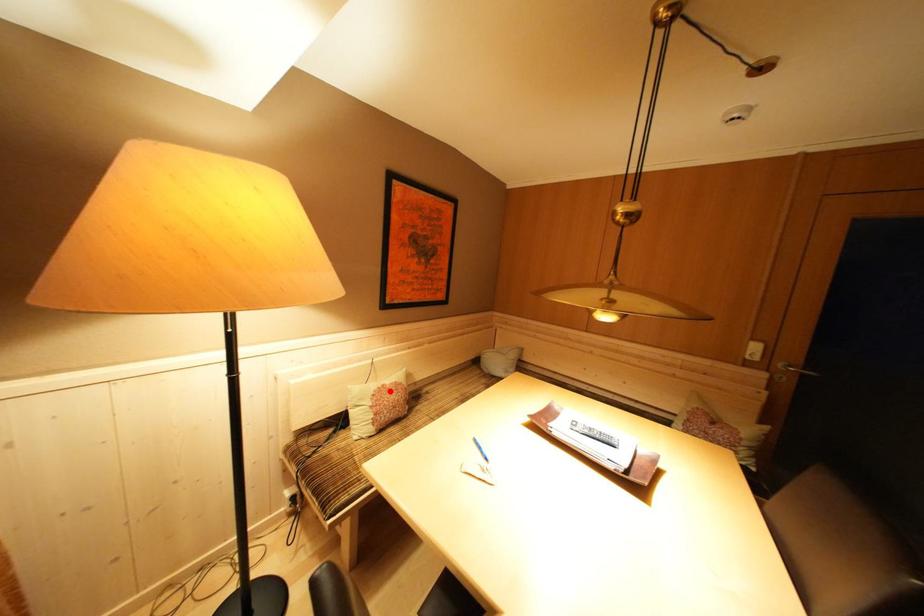
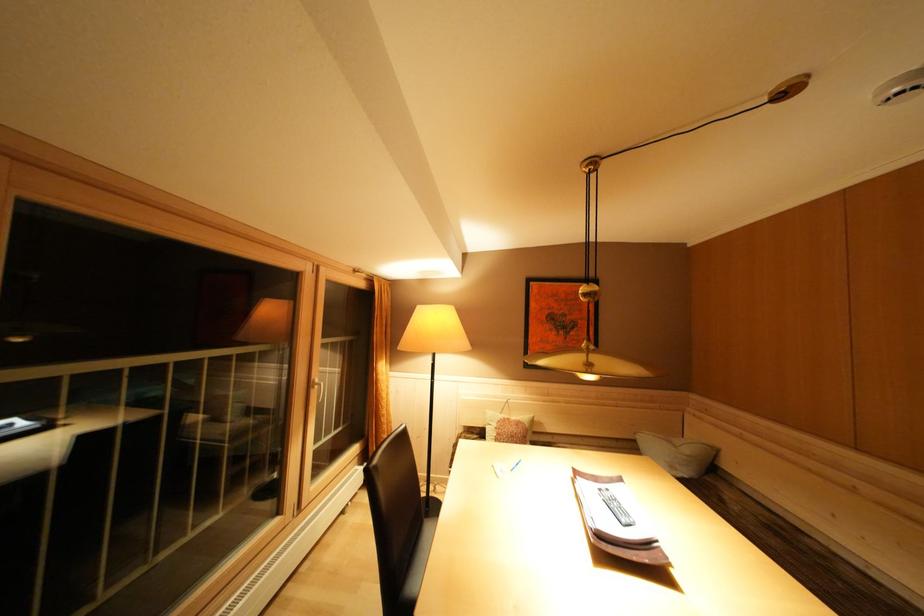
Question: A red point is marked in image1. In image2, is the corresponding 3D point closer to the camera or farther? Reply with the corresponding letter.

Choices:
 (A) The corresponding 3D point is closer.
 (B) The corresponding 3D point is farther.

Answer: (B)